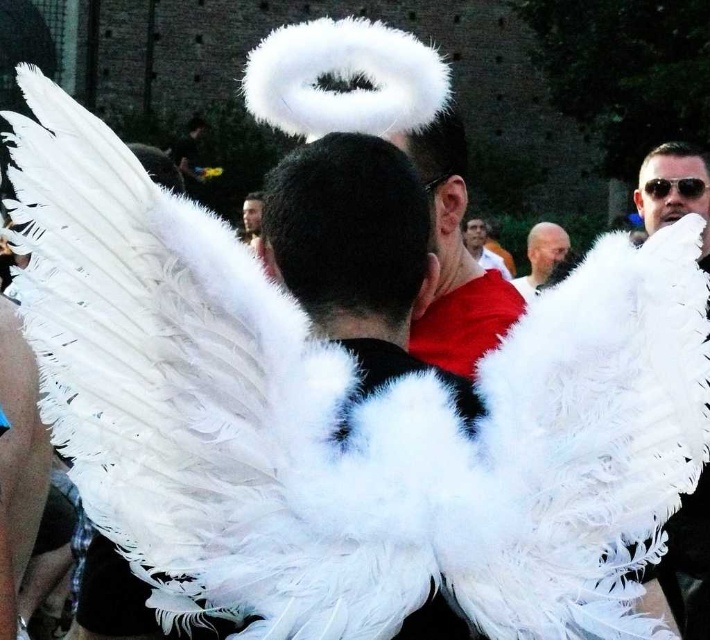
You are an event organizer planning a charity walk. You need to ensure that the angel costume with the white feathered wings at upper center and bald head at center can fit through a standard doorway that is 2 meters tall. Can the costume pass through without bending or adjusting the wings?

The white feathered wings at upper center is taller than bald head at center. Since the doorway is 2 meters tall, we need to know the height of the tallest part of the costume. However, the provided information does not specify the actual height measurements of the costume components. Without this data, it is impossible to determine if the costume can fit through the doorway without additional adjustments.

You are a costume designer trying to create a similar angel costume. You need to decide whether the white feathered wings at upper center will extend beyond the bald head at center. Based on the image, can you determine if the wings are wider than the head?

The white feathered wings at upper center might be wider than bald head at center, so it is possible that the wings extend beyond the head.